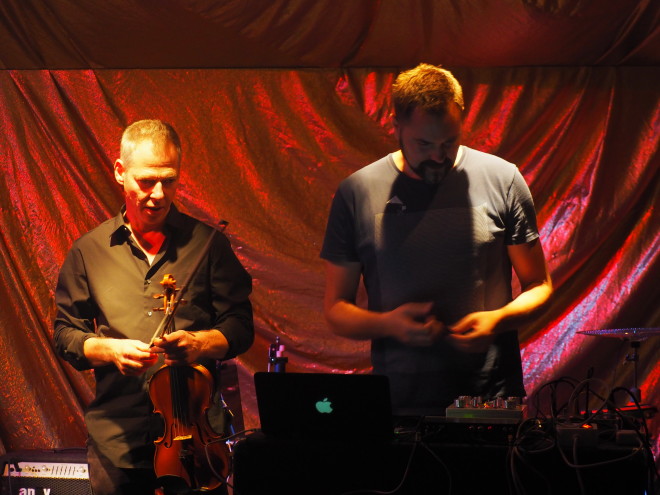
Where is `laptop`? laptop is located at coordinates (288, 386).